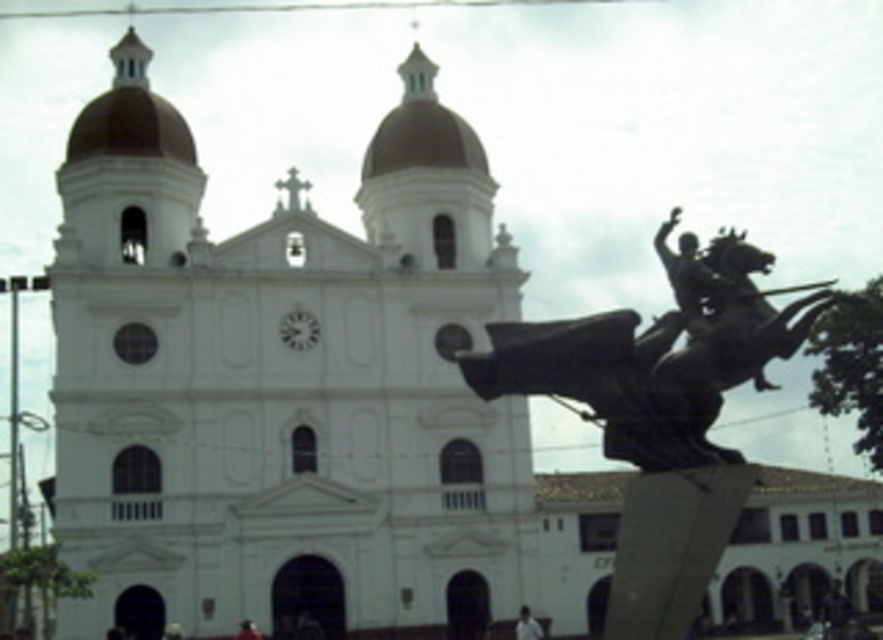
Question: Which point is farther from the camera taking this photo?

Choices:
 (A) (647, 420)
 (B) (519, 632)
 (C) (240, 636)

Answer: (B)

Question: Does bronze statue at center appear on the right side of white matte person at lower center?

Choices:
 (A) yes
 (B) no

Answer: (A)

Question: Is bronze statue at center to the right of white matte person at lower center from the viewer's perspective?

Choices:
 (A) no
 (B) yes

Answer: (B)

Question: Which object is positioned farthest from the bronze statue at center?

Choices:
 (A) smooth red shirt at lower left
 (B) white matte person at lower center

Answer: (A)

Question: Can you confirm if white matte person at lower center is wider than smooth red shirt at lower left?

Choices:
 (A) no
 (B) yes

Answer: (B)

Question: Which of these objects is positioned farthest from the bronze statue at center?

Choices:
 (A) white matte person at lower center
 (B) smooth red shirt at lower left

Answer: (B)